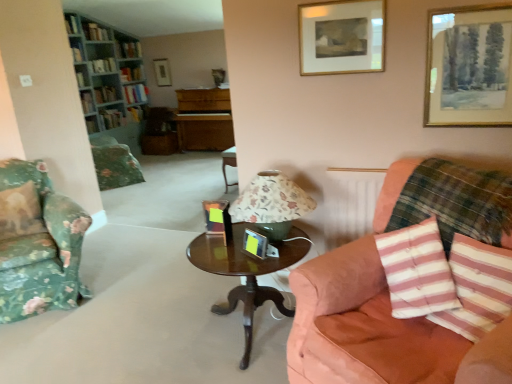
Image resolution: width=512 pixels, height=384 pixels. What are the coordinates of `free point above pink striped pillow at lower right, the 1th pillow viewed from the front (from a real-world perspective)` in the screenshot? It's located at (485, 243).